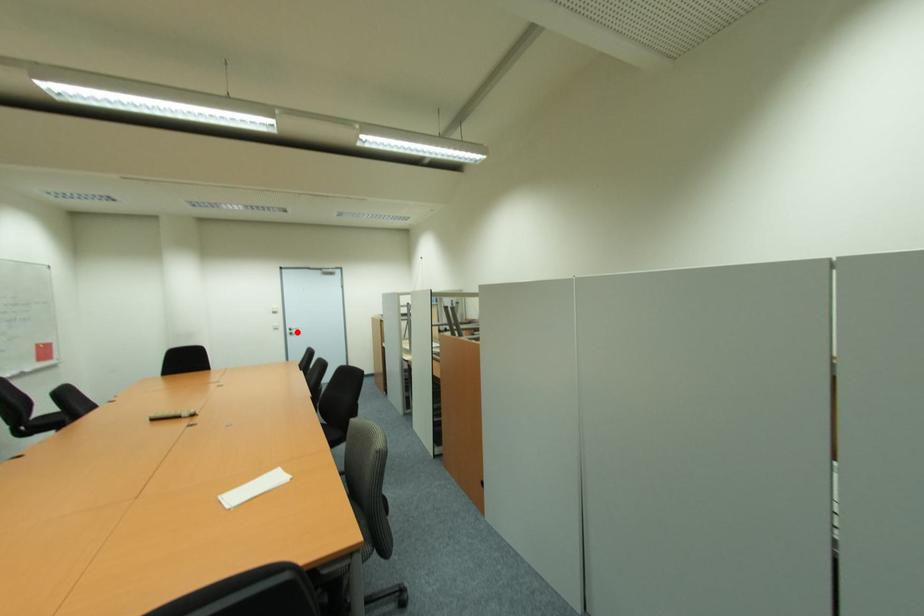
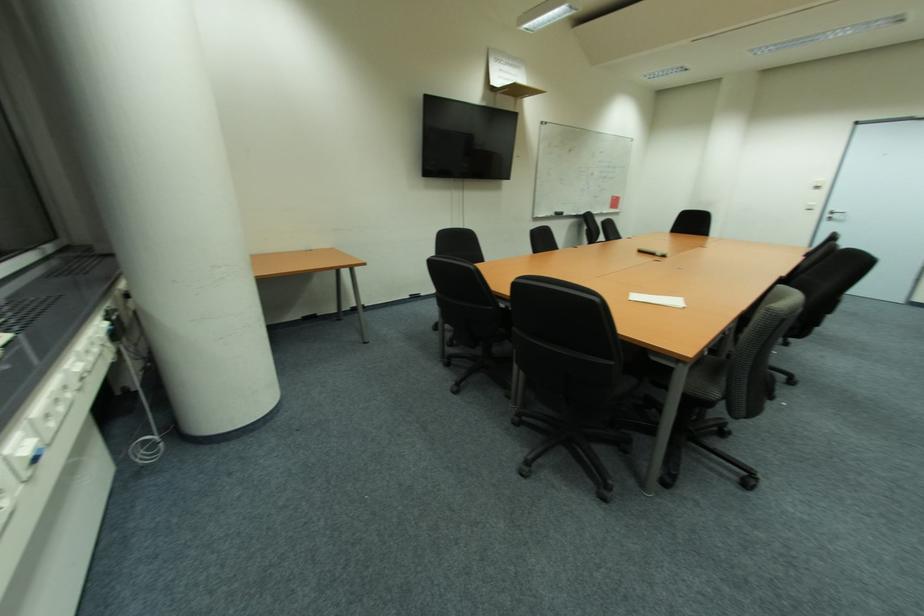
Question: I am providing you with two images of the same scene from different viewpoints. Given a red point in image1, look at the same physical point in image2. Is it:

Choices:
 (A) Closer to the viewpoint
 (B) Farther from the viewpoint

Answer: (B)